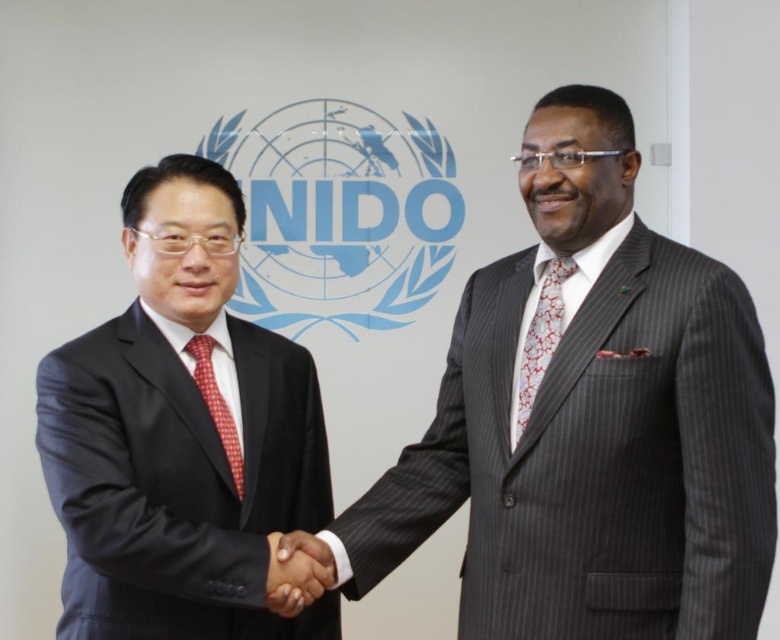
You are a photographer at the event and want to capture a closeup shot of the gray pinstripe suit at center and the smooth skin handshake at center. What is the minimum distance you need to set your camera lens to focus on both objects clearly?

The gray pinstripe suit at center is 18.30 inches away from the smooth skin handshake at center. To ensure both are in focus, the camera lens should be set to a focal length that accommodates this distance. A smaller aperture or a higher fstop value would help increase depth of field, allowing both objects to be sharp.

You are a photographer at the UNIDO event and need to ensure that both the gray pinstripe suit at center and the smooth skin handshake at center are clearly visible in your photo. Considering their sizes, which one should you focus on to ensure both are in frame?

The gray pinstripe suit at center is bigger than the smooth skin handshake at center, so focusing on the gray pinstripe suit at center will ensure both are in frame as it is larger and occupies more space.

You are standing in front of the UNIDO logo backdrop. There is a matte black suit at left. Can you confirm if the point at coordinates (181, 435) is part of the matte black suit at left?

The point at coordinates (181, 435) is part of the matte black suit at left.